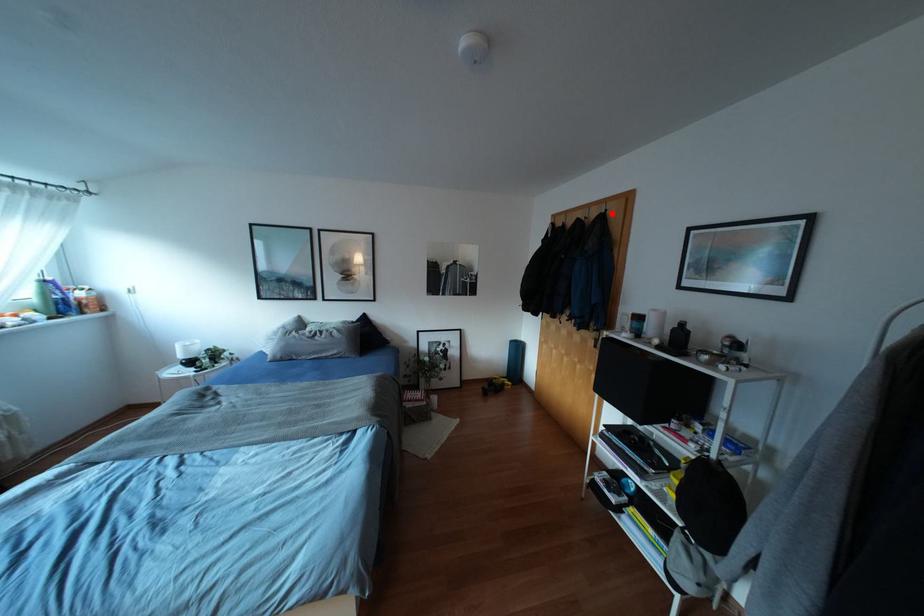
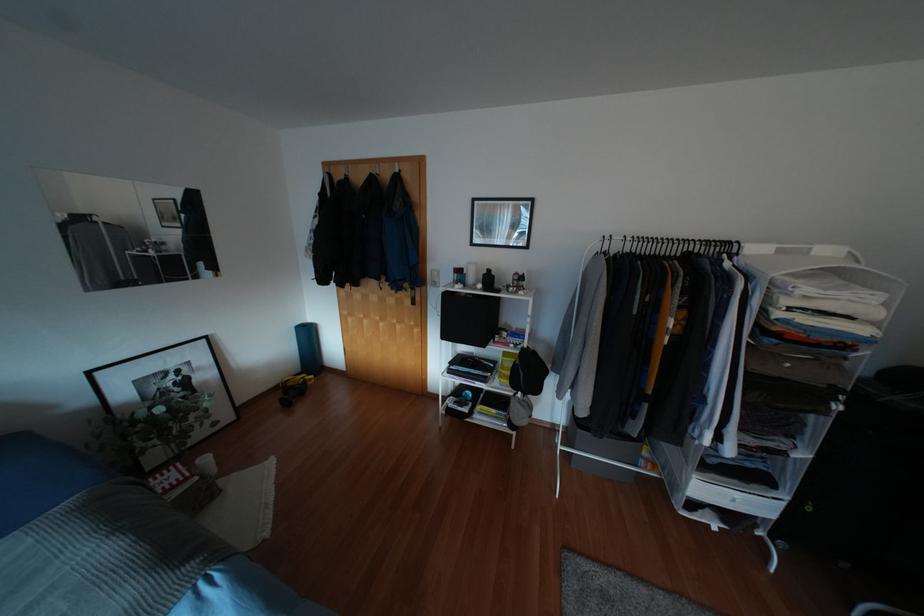
Where in the second image is the point corresponding to the highlighted location from the first image?

(406, 176)